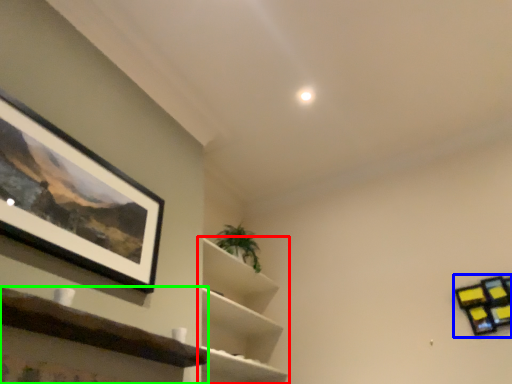
Question: Which object is the closest to the shelf (highlighted by a red box)? Choose among these: shelf (highlighted by a blue box) or shelf (highlighted by a green box).

Choices:
 (A) shelf
 (B) shelf

Answer: (B)